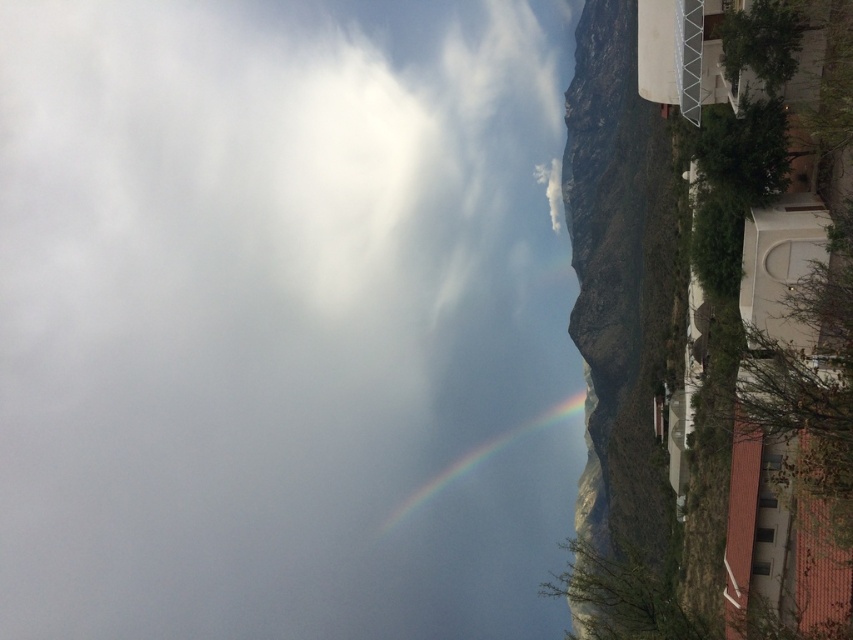
Between point (630, 545) and point (532, 420), which one is positioned behind?

The point (532, 420) is more distant.

Is rugged stone mountain at right wider than rainbow at center?

In fact, rugged stone mountain at right might be narrower than rainbow at center.

Locate an element on the screen. This screenshot has width=853, height=640. rugged stone mountain at right is located at coordinates [619, 294].

Is white fluffy cloud at upper left thinner than rainbow at center?

Incorrect, white fluffy cloud at upper left's width is not less than rainbow at center's.

Is white fluffy cloud at upper left below rainbow at center?

No, white fluffy cloud at upper left is not below rainbow at center.

The image size is (853, 640). Describe the element at coordinates (283, 320) in the screenshot. I see `white fluffy cloud at upper left` at that location.

This screenshot has height=640, width=853. Identify the location of white fluffy cloud at upper left. (283, 320).

Does white fluffy cloud at upper left come in front of rugged stone mountain at right?

No, white fluffy cloud at upper left is behind rugged stone mountain at right.

Is white fluffy cloud at upper left to the left of rugged stone mountain at right from the viewer's perspective?

Indeed, white fluffy cloud at upper left is positioned on the left side of rugged stone mountain at right.

This screenshot has height=640, width=853. What do you see at coordinates (283, 320) in the screenshot? I see `white fluffy cloud at upper left` at bounding box center [283, 320].

What are the coordinates of `white fluffy cloud at upper left` in the screenshot? It's located at (283, 320).